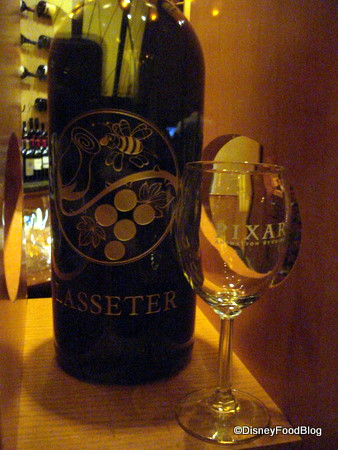
This screenshot has width=338, height=450. I want to click on wood table, so click(x=87, y=420), click(x=37, y=331).